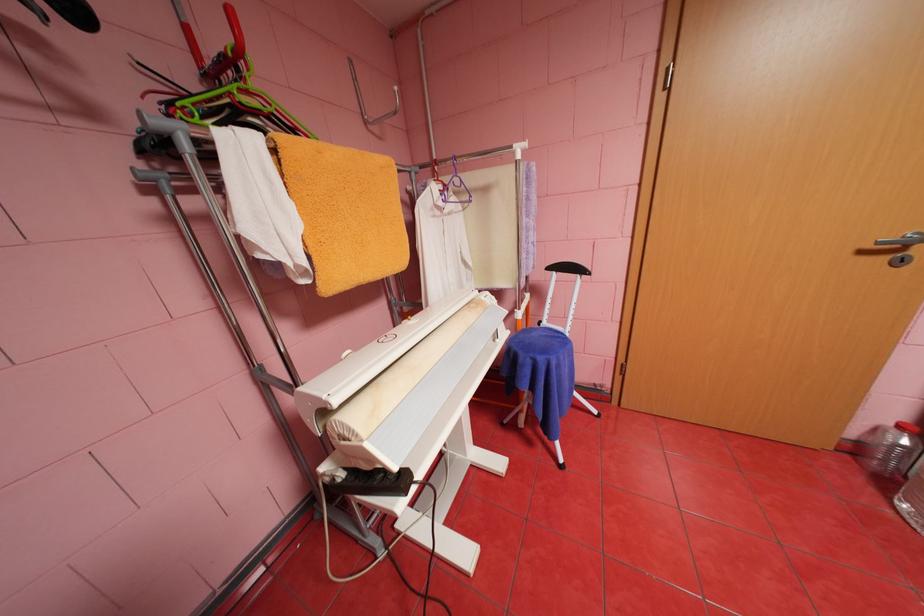
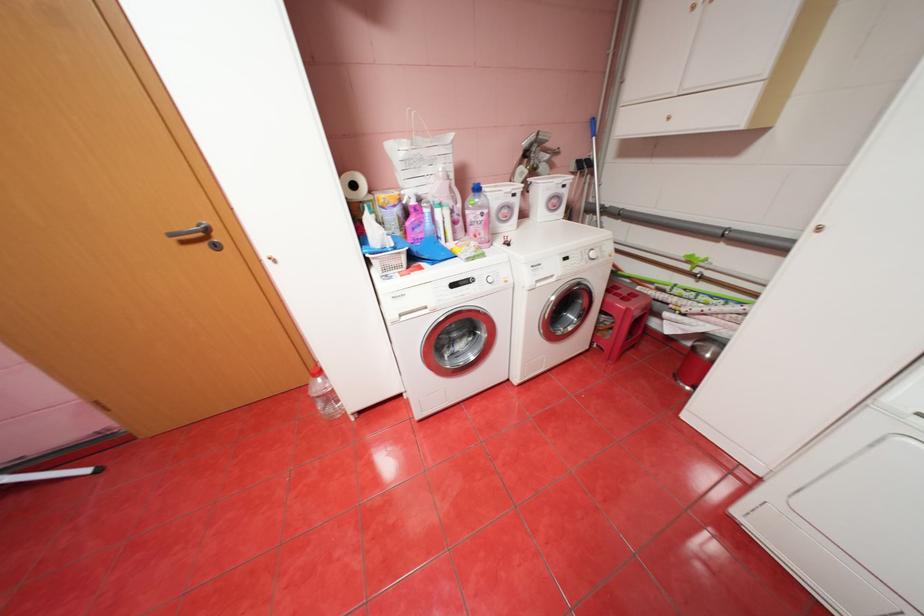
Locate, in the second image, the point that corresponds to [893,257] in the first image.

(213, 245)